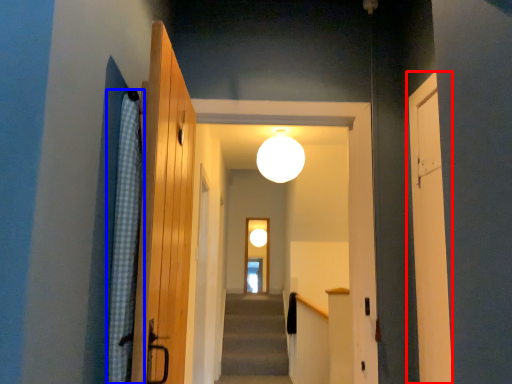
Question: Which object appears closest to the camera in this image, door (highlighted by a red box) or curtain (highlighted by a blue box)?

Choices:
 (A) door
 (B) curtain

Answer: (B)